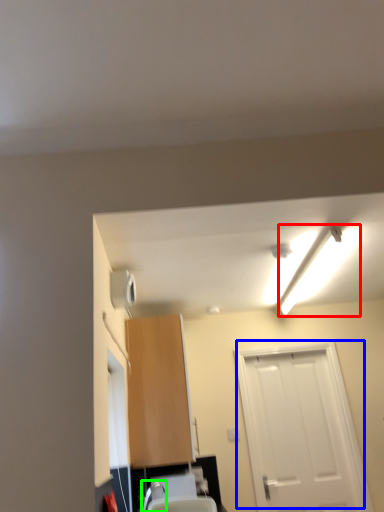
Question: Which object is positioned farthest from light fixture (highlighted by a red box)? Select from door (highlighted by a blue box) and faucet (highlighted by a green box).

Choices:
 (A) door
 (B) faucet

Answer: (B)